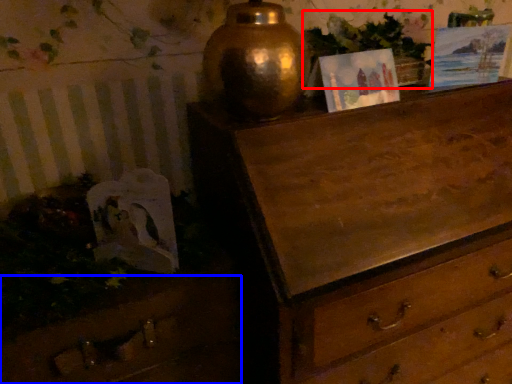
Question: Which of the following is the closest to the observer, vegetation (highlighted by a red box) or drawer (highlighted by a blue box)?

Choices:
 (A) vegetation
 (B) drawer

Answer: (B)